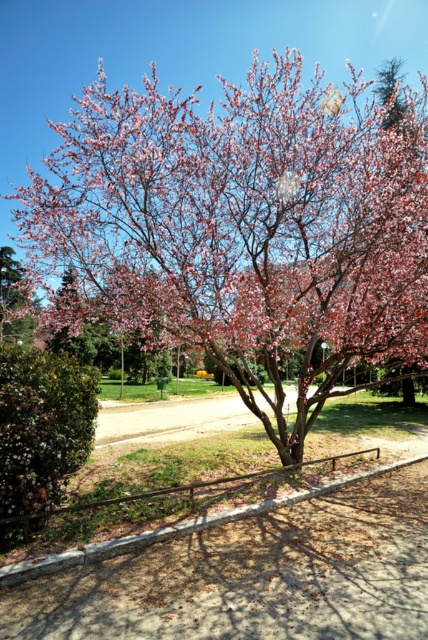
Is pink matte flower at center behind pink matte tree at upper left?

No, it is not.

Does pink matte flower at center appear on the left side of pink matte tree at upper left?

No, pink matte flower at center is not to the left of pink matte tree at upper left.

Does point (329, 257) lie behind point (35, 304)?

No, it is in front of (35, 304).

You are a GUI agent. You are given a task and a screenshot of the screen. Output one action in this format:
    pyautogui.click(x=<x>, y=<y>)
    Task: Click on the pink matte flower at center
    The image size is (428, 640).
    Given the screenshot: What is the action you would take?
    pyautogui.click(x=243, y=212)